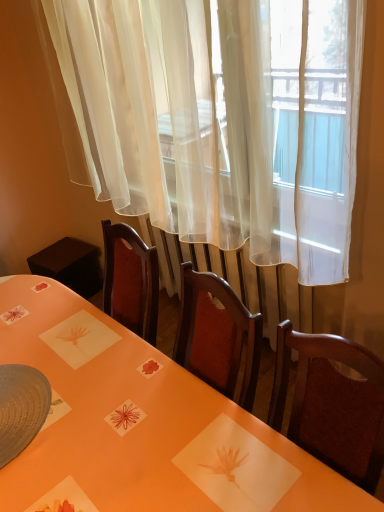
Question: From a real-world perspective, relative to orange glossy table at center, is white sheer curtain at upper center vertically above or below?

Choices:
 (A) below
 (B) above

Answer: (B)

Question: Looking at their shapes, would you say white sheer curtain at upper center is wider or thinner than orange glossy table at center?

Choices:
 (A) wide
 (B) thin

Answer: (B)

Question: Considering their positions, is white sheer curtain at upper center located in front of or behind orange glossy table at center?

Choices:
 (A) front
 (B) behind

Answer: (B)

Question: Is orange glossy table at center situated inside white sheer curtain at upper center or outside?

Choices:
 (A) inside
 (B) outside

Answer: (B)

Question: Considering the positions of orange glossy table at center and white sheer curtain at upper center in the image, is orange glossy table at center wider or thinner than white sheer curtain at upper center?

Choices:
 (A) wide
 (B) thin

Answer: (A)

Question: In terms of height, does orange glossy table at center look taller or shorter compared to white sheer curtain at upper center?

Choices:
 (A) short
 (B) tall

Answer: (A)

Question: Considering the relative positions of orange glossy table at center and white sheer curtain at upper center in the image provided, is orange glossy table at center to the left or to the right of white sheer curtain at upper center?

Choices:
 (A) left
 (B) right

Answer: (A)